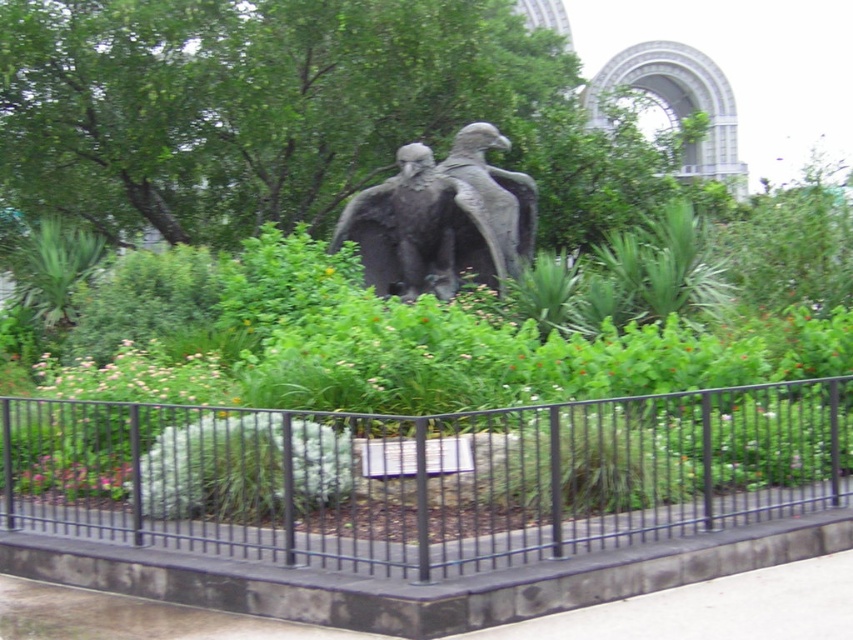
Which is more to the right, green leafy tree at center or gray stone eagle at center?

gray stone eagle at center

Is green leafy tree at center shorter than gray stone eagle at center?

Yes, green leafy tree at center is shorter than gray stone eagle at center.

Is point (492, 120) positioned in front of point (480, 154)?

No, (492, 120) is behind (480, 154).

You are a GUI agent. You are given a task and a screenshot of the screen. Output one action in this format:
    pyautogui.click(x=<x>, y=<y>)
    Task: Click on the green leafy tree at center
    
    Given the screenshot: What is the action you would take?
    pyautogui.click(x=245, y=102)

Can you confirm if gray concrete pavement at center is wider than bronze eagle at center?

Incorrect, gray concrete pavement at center's width does not surpass bronze eagle at center's.

Who is more forward, (795,584) or (505,180)?

Point (795,584) is more forward.

I want to click on gray concrete pavement at center, so click(712, 609).

Does bronze eagle at center have a smaller size compared to gray stone eagle at center?

No.

Who is more distant from viewer, (503,172) or (467,236)?

Positioned behind is point (503,172).

You are a GUI agent. You are given a task and a screenshot of the screen. Output one action in this format:
    pyautogui.click(x=<x>, y=<y>)
    Task: Click on the bronze eagle at center
    This screenshot has height=640, width=853.
    Given the screenshot: What is the action you would take?
    pyautogui.click(x=442, y=220)

The image size is (853, 640). I want to click on bronze eagle at center, so click(442, 220).